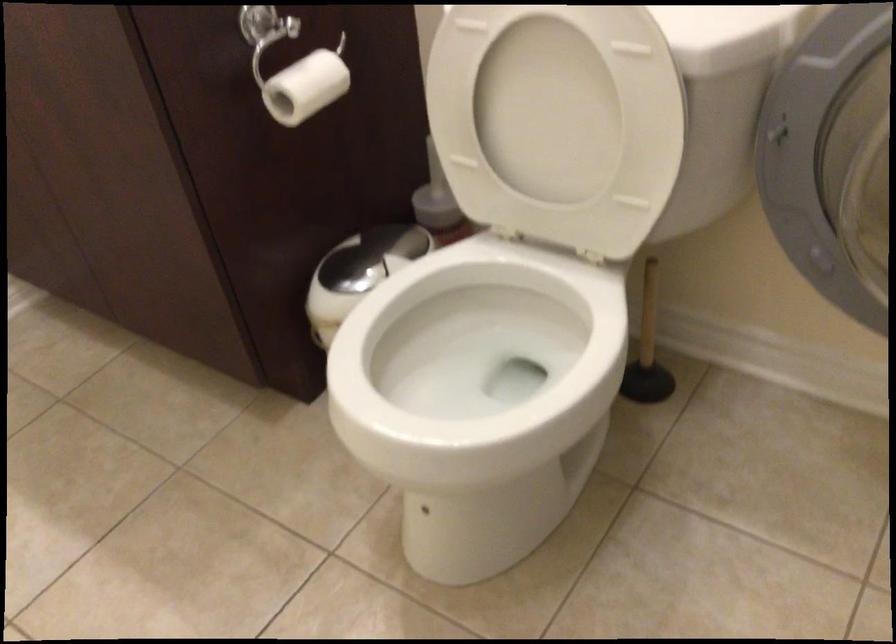
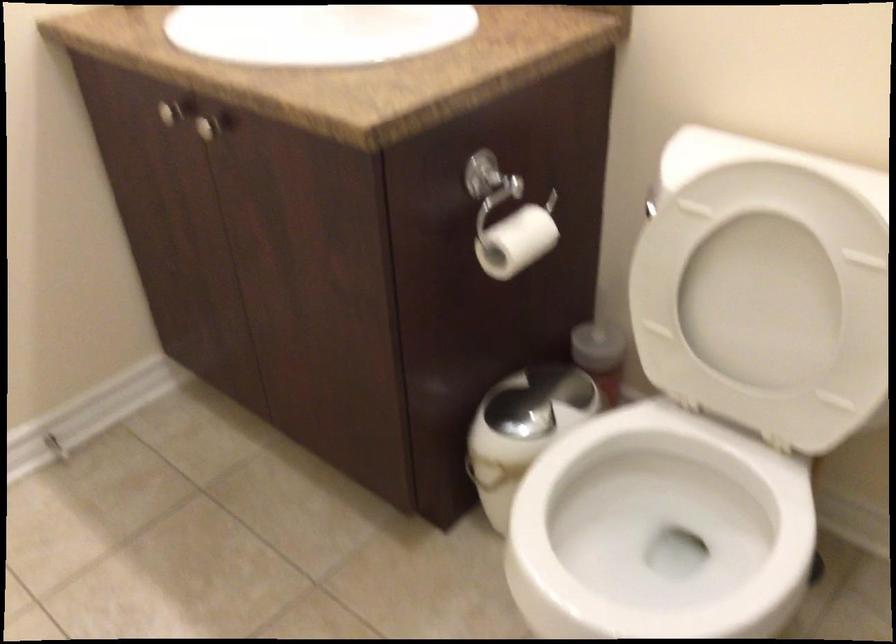
Where in the second image is the point corresponding to (x=555, y=114) from the first image?

(763, 299)